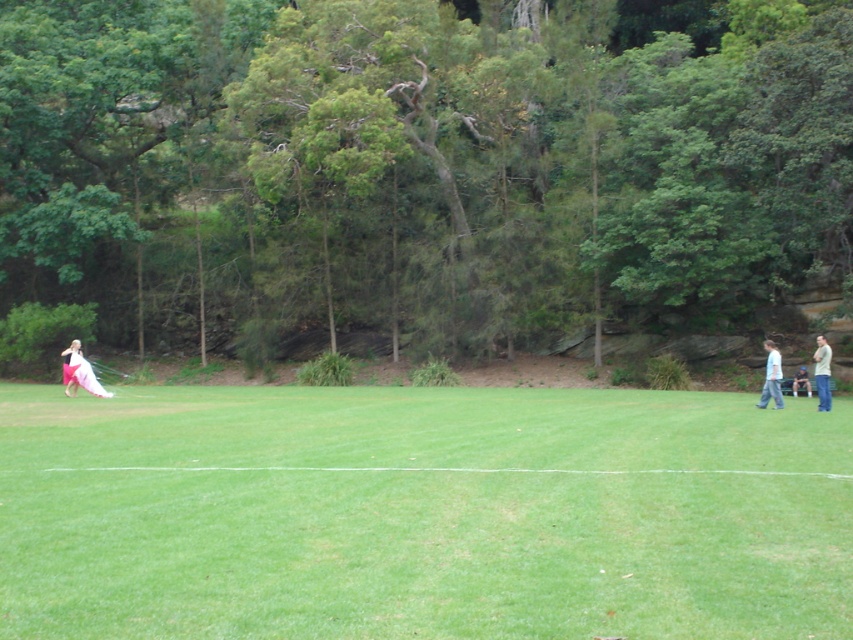
Question: Based on their relative distances, which object is nearer to the green leafy tree at upper center?

Choices:
 (A) blue denim jeans at lower right
 (B) light brown casual shirt at right
 (C) white satin dress at left
 (D) matte pink dress at left

Answer: (D)

Question: Can you confirm if green leafy tree at upper center is thinner than matte pink dress at left?

Choices:
 (A) yes
 (B) no

Answer: (B)

Question: Does light blue cotton shirt at right lie in front of light brown casual shirt at right?

Choices:
 (A) yes
 (B) no

Answer: (B)

Question: Which of the following is the closest to the observer?

Choices:
 (A) white satin dress at left
 (B) light brown casual shirt at right

Answer: (B)

Question: Can you confirm if green leafy tree at upper center is thinner than blue denim jeans at lower right?

Choices:
 (A) no
 (B) yes

Answer: (A)

Question: Among these points, which one is farthest from the camera?

Choices:
 (A) (769, 376)
 (B) (848, 147)
 (C) (820, 348)
 (D) (677, 602)

Answer: (B)